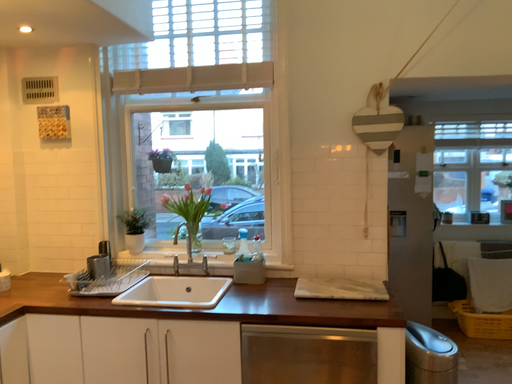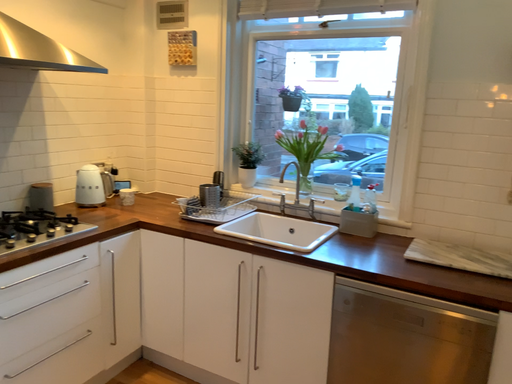
Question: How did the camera likely rotate when shooting the video?

Choices:
 (A) rotated left
 (B) rotated right

Answer: (A)